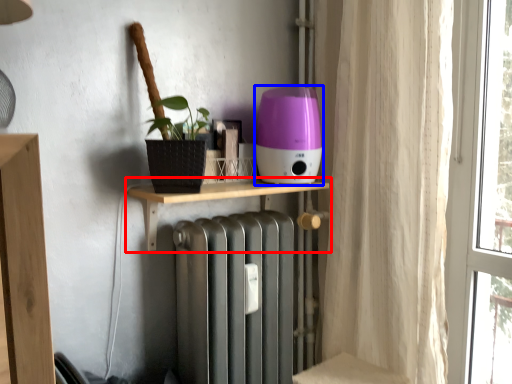
Question: Which object is further to the camera taking this photo, shelf (highlighted by a red box) or appliance (highlighted by a blue box)?

Choices:
 (A) shelf
 (B) appliance

Answer: (B)